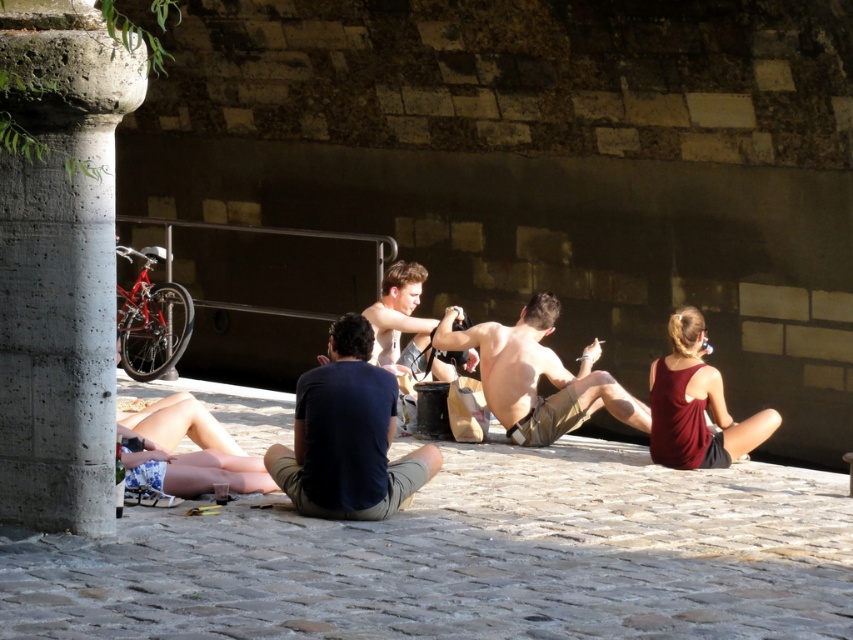
Question: Which point is closer to the camera taking this photo?

Choices:
 (A) (305, 380)
 (B) (415, 348)

Answer: (A)

Question: Which object is the farthest from the smooth skin man at center?

Choices:
 (A) dark blue t-shirt at center
 (B) blue floral shorts at lower left
 (C) concrete column at left
 (D) matte maroon tank top at center

Answer: (C)

Question: Which object is farther from the camera taking this photo?

Choices:
 (A) blue floral shorts at lower left
 (B) shiny metallic phone at center
 (C) smooth skin man at center
 (D) dark blue t-shirt at center

Answer: (C)

Question: Can you confirm if dark blue t-shirt at center is smaller than matte maroon tank top at center?

Choices:
 (A) no
 (B) yes

Answer: (A)

Question: Does matte maroon tank top at center appear over smooth skin man at center?

Choices:
 (A) yes
 (B) no

Answer: (B)

Question: In this image, where is concrete column at left located relative to shiny metallic phone at center?

Choices:
 (A) above
 (B) below

Answer: (A)